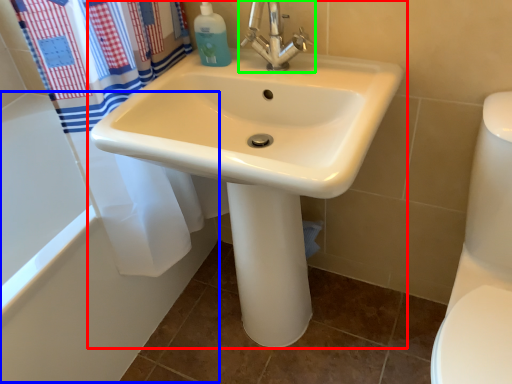
Question: Based on their relative distances, which object is nearer to sink (highlighted by a red box)? Choose from bath (highlighted by a blue box) and tap (highlighted by a green box).

Choices:
 (A) bath
 (B) tap

Answer: (B)